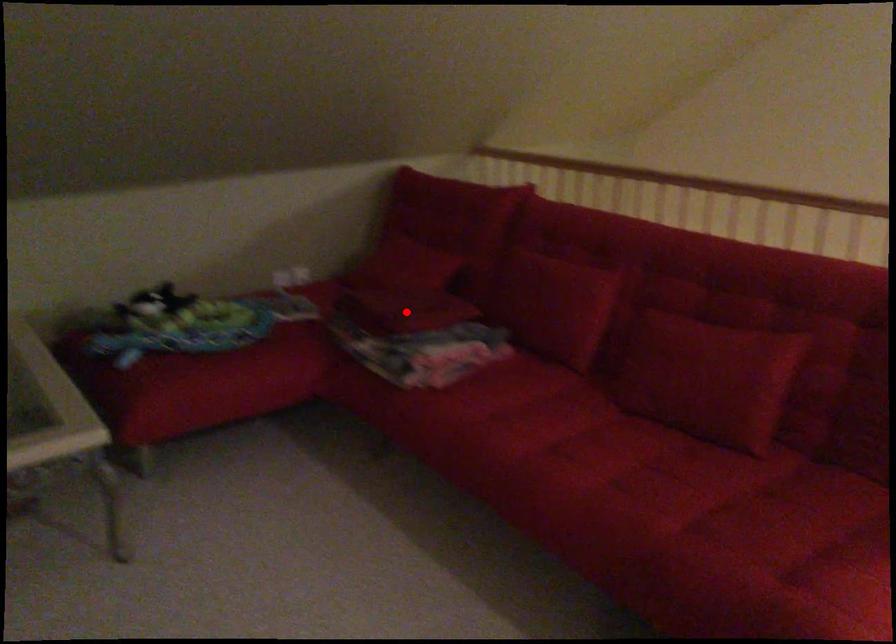
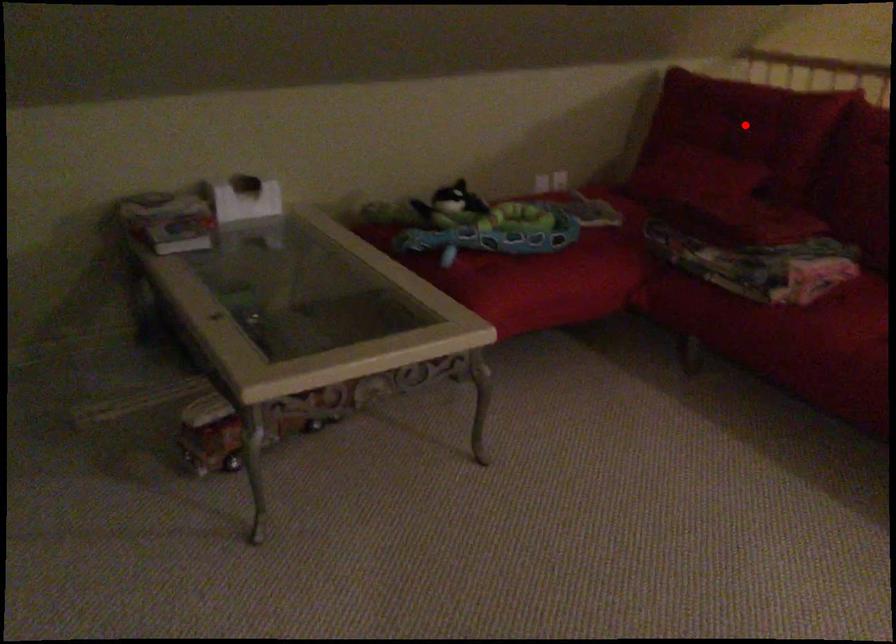
I am providing you with two images of the same scene from different viewpoints. A red point is marked on the first image and another point is marked on the second image. Do the highlighted points in image1 and image2 indicate the same real-world spot?

No